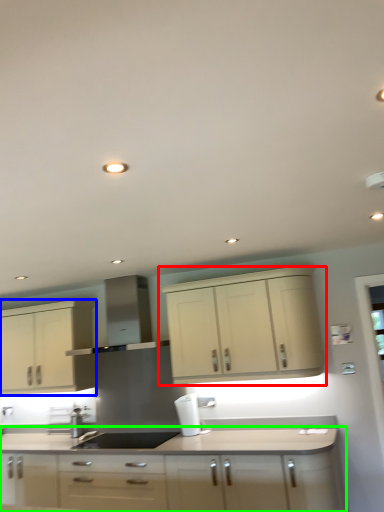
Question: Which is nearer to the cabinetry (highlighted by a red box)? cabinetry (highlighted by a blue box) or cabinetry (highlighted by a green box).

Choices:
 (A) cabinetry
 (B) cabinetry

Answer: (B)